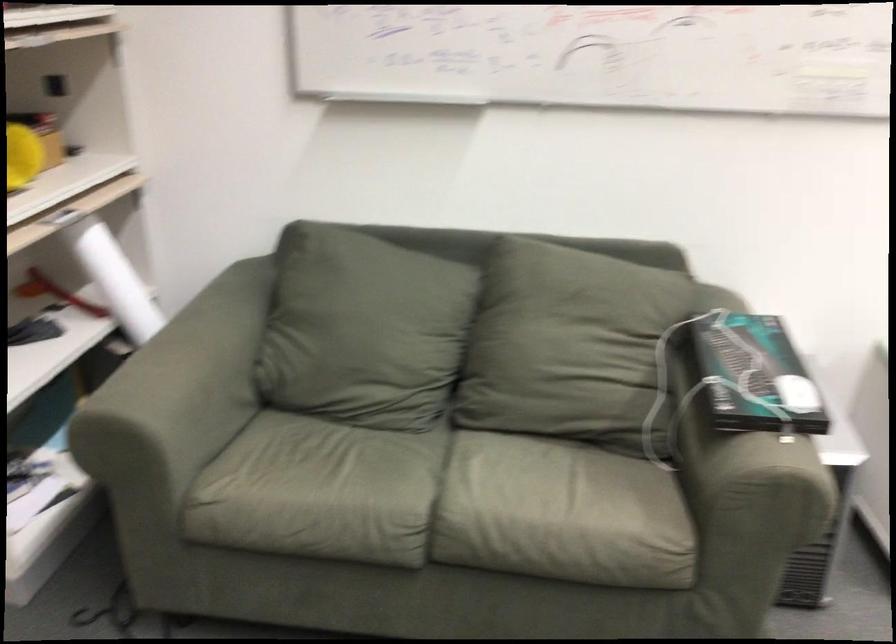
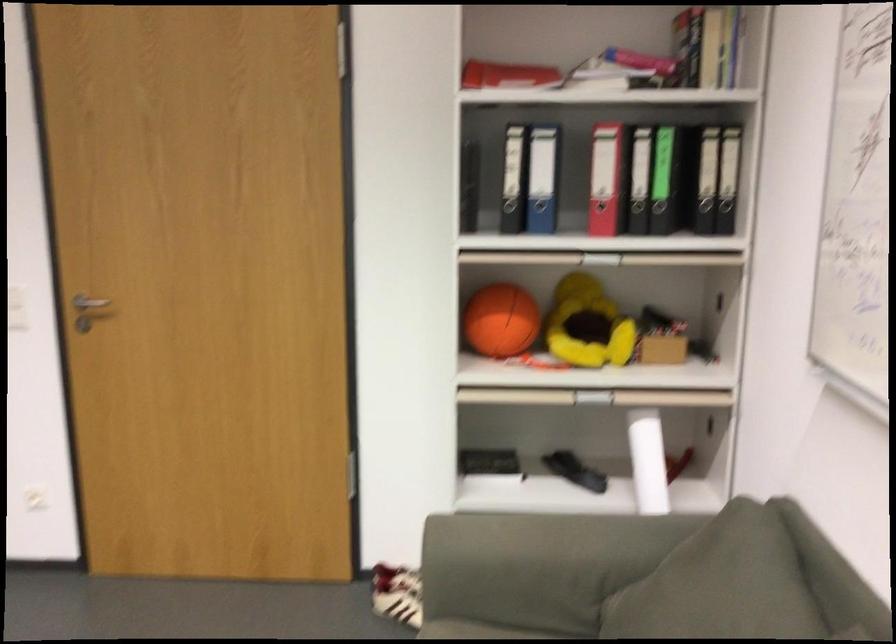
Find the pixel in the second image that matches point 85,80 in the first image.

(725, 283)